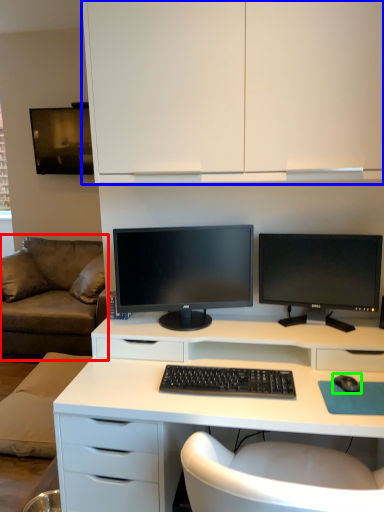
Question: Which object is the closest to the studio couch (highlighted by a red box)? Choose among these: cabinetry (highlighted by a blue box) or mouse (highlighted by a green box).

Choices:
 (A) cabinetry
 (B) mouse

Answer: (A)